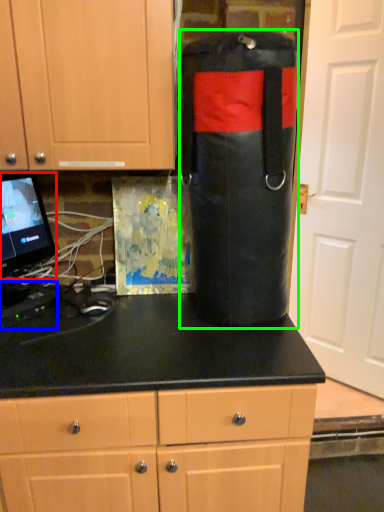
Question: Estimate the real-world distances between objects in this image. Which object is closer to computer monitor (highlighted by a red box), appliance (highlighted by a blue box) or punching bag (highlighted by a green box)?

Choices:
 (A) appliance
 (B) punching bag

Answer: (A)